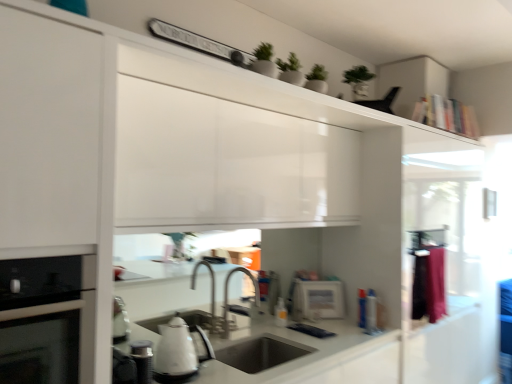
Question: Visually, is silver metallic faucet at center positioned to the left or to the right of white glossy microwave at center, the third appliance viewed from the top?

Choices:
 (A) right
 (B) left

Answer: (B)

Question: Considering the positions of silver metallic faucet at center and white glossy microwave at center, acting as the first appliance starting from the right, in the image, is silver metallic faucet at center taller or shorter than white glossy microwave at center, acting as the first appliance starting from the right,?

Choices:
 (A) tall
 (B) short

Answer: (A)

Question: Which object is the farthest from the translucent plastic bottle at sink?

Choices:
 (A) silver metallic faucet at center
 (B) white glossy kettle at lower center
 (C) white glossy kettle at lower left, which ranks as the first appliance in front-to-back order
 (D) pink fabric at right
 (E) matte stainless steel sink at center

Answer: (C)

Question: Considering the real-world distances, which object is farthest from the matte stainless steel sink at center?

Choices:
 (A) white glossy kettle at lower left, the 2th appliance positioned from the bottom
 (B) white glossy microwave at center, the first appliance viewed from the back
 (C) white glossy kettle at lower center
 (D) translucent plastic bottle at sink
 (E) wooden sign at upper center, which is counted as the 2th appliance, starting from the back

Answer: (E)